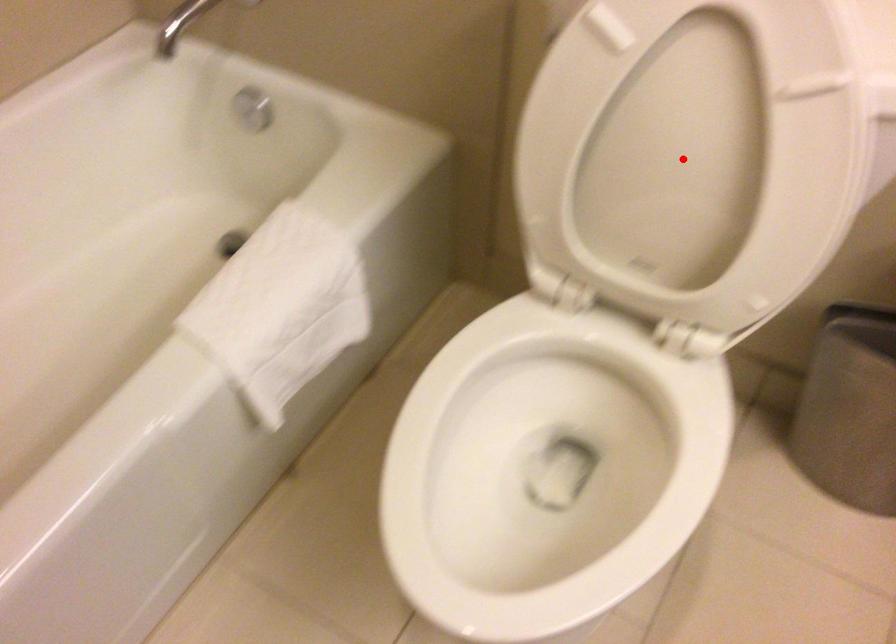
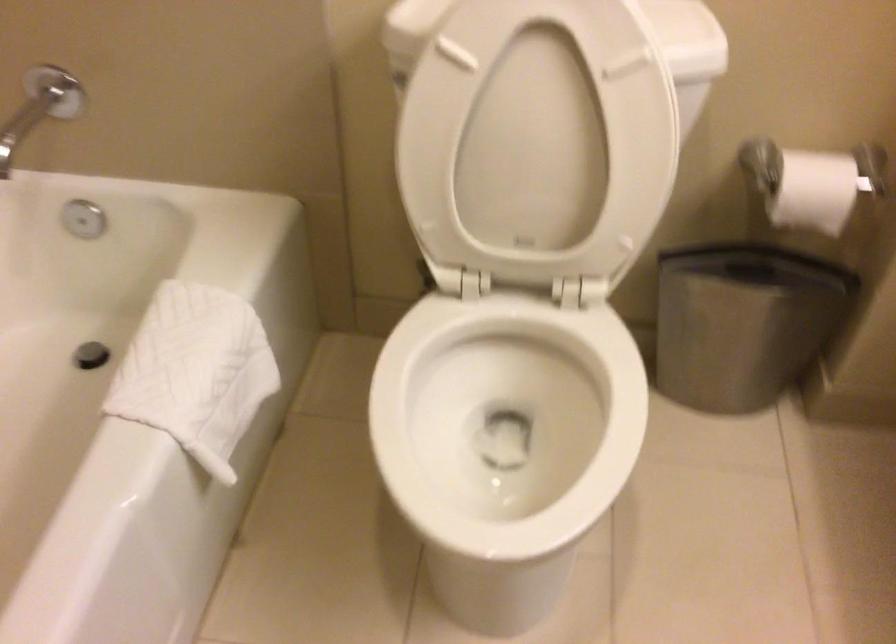
In the second image, find the point that corresponds to the highlighted location in the first image.

(538, 140)